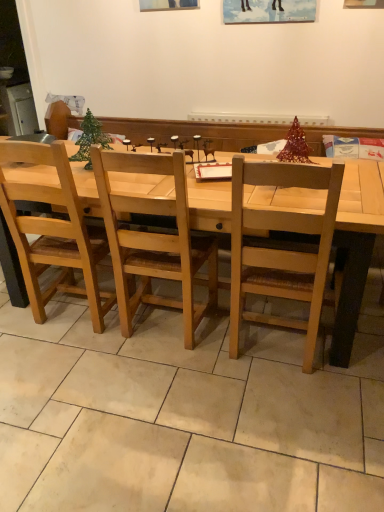
Question: Considering the relative positions of natural wood table at center and metallic green christmas tree at center in the image provided, is natural wood table at center to the left of metallic green christmas tree at center from the viewer's perspective?

Choices:
 (A) yes
 (B) no

Answer: (B)

Question: Does natural wood table at center lie behind metallic green christmas tree at center?

Choices:
 (A) no
 (B) yes

Answer: (A)

Question: Can you confirm if natural wood table at center is shorter than metallic green christmas tree at center?

Choices:
 (A) yes
 (B) no

Answer: (B)

Question: Is natural wood table at center to the right of metallic green christmas tree at center from the viewer's perspective?

Choices:
 (A) no
 (B) yes

Answer: (B)

Question: From a real-world perspective, is natural wood table at center under metallic green christmas tree at center?

Choices:
 (A) no
 (B) yes

Answer: (B)

Question: Is metallic green christmas tree at center in front of or behind light brown wood chair at center, the second chair positioned from the right, in the image?

Choices:
 (A) behind
 (B) front

Answer: (A)

Question: Considering the positions of metallic green christmas tree at center and light brown wood chair at center, the first chair positioned from the left, in the image, is metallic green christmas tree at center taller or shorter than light brown wood chair at center, the first chair positioned from the left,?

Choices:
 (A) tall
 (B) short

Answer: (B)

Question: From the image's perspective, is metallic green christmas tree at center positioned above or below light brown wood chair at center, the first chair positioned from the left?

Choices:
 (A) below
 (B) above

Answer: (B)

Question: Is metallic green christmas tree at center wider or thinner than light brown wood chair at center, the second chair positioned from the right?

Choices:
 (A) wide
 (B) thin

Answer: (B)

Question: From the image's perspective, relative to natural wood table at center, is metallic green christmas tree at center above or below?

Choices:
 (A) below
 (B) above

Answer: (B)

Question: Is metallic green christmas tree at center inside or outside of natural wood table at center?

Choices:
 (A) inside
 (B) outside

Answer: (B)

Question: Is metallic green christmas tree at center in front of or behind natural wood table at center in the image?

Choices:
 (A) front
 (B) behind

Answer: (B)

Question: In terms of width, does metallic green christmas tree at center look wider or thinner when compared to natural wood table at center?

Choices:
 (A) thin
 (B) wide

Answer: (A)

Question: From a real-world perspective, is light brown wood chair at center, the second chair positioned from the right, physically located above or below natural wood table at center?

Choices:
 (A) above
 (B) below

Answer: (A)

Question: Is light brown wood chair at center, the second chair positioned from the right, bigger or smaller than natural wood table at center?

Choices:
 (A) small
 (B) big

Answer: (A)